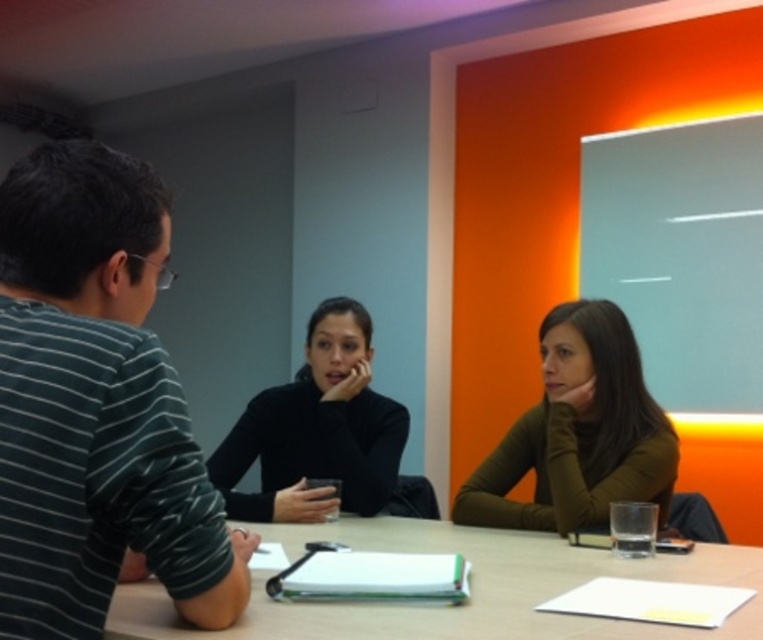
At what (x,y) coordinates should I click in order to perform the action: click on smooth wooden table at center. Please return your answer as a coordinate pair (x, y). Looking at the image, I should click on 469,588.

Is point (539, 564) positioned in front of point (298, 490)?

Yes, point (539, 564) is in front of point (298, 490).

The height and width of the screenshot is (640, 763). Find the location of `smooth wooden table at center`. smooth wooden table at center is located at coordinates (469, 588).

The image size is (763, 640). Identify the location of striped cotton shirt at left. (98, 403).

Measure the distance between striped cotton shirt at left and matte green sweater at center.

3.46 feet

Locate an element on the screen. The height and width of the screenshot is (640, 763). striped cotton shirt at left is located at coordinates (98, 403).

This screenshot has height=640, width=763. Find the location of `striped cotton shirt at left`. striped cotton shirt at left is located at coordinates (98, 403).

Is point (105, 301) positioned behind point (269, 531)?

No, (105, 301) is closer to viewer.

I want to click on striped cotton shirt at left, so click(98, 403).